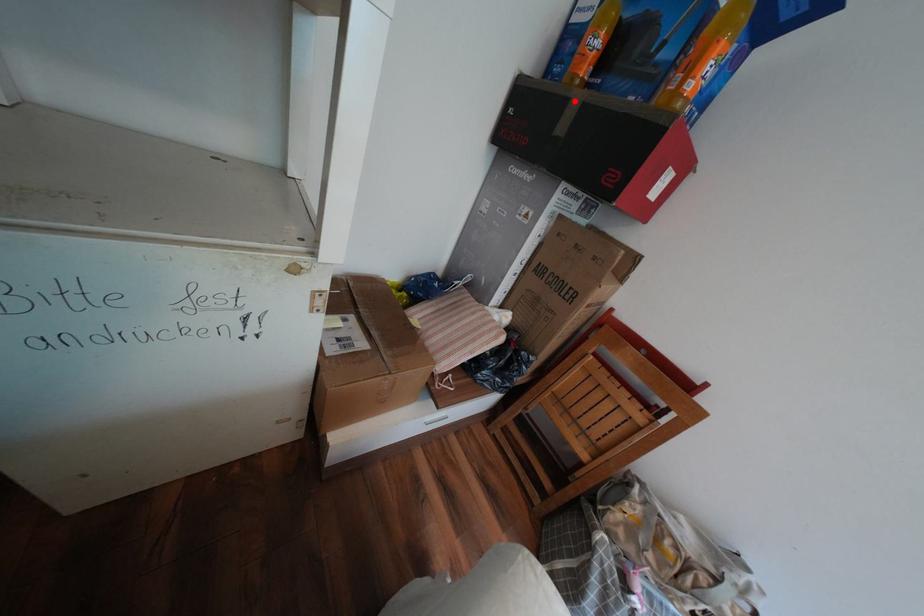
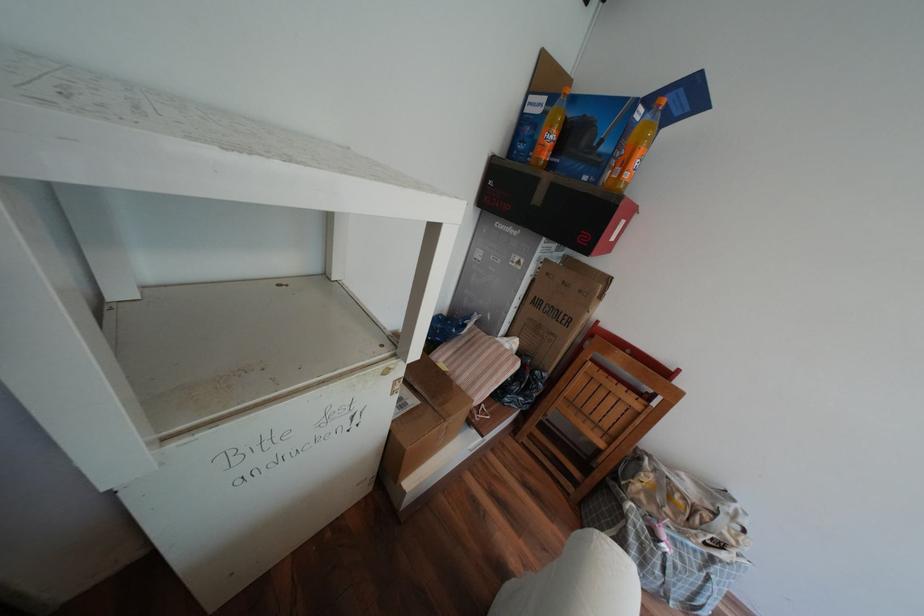
Where in the second image is the point corresponding to the highlighted location from the first image?

(545, 180)